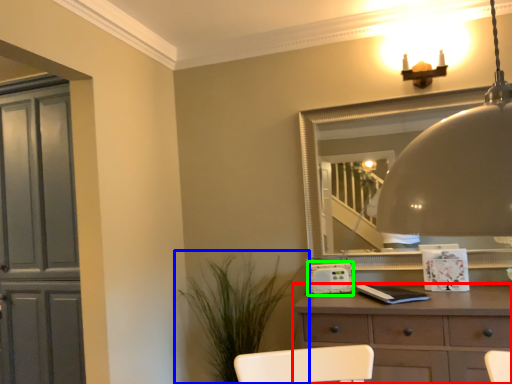
Question: Which is farther away from chest of drawers (highlighted by a red box)? houseplant (highlighted by a blue box) or appliance (highlighted by a green box)?

Choices:
 (A) houseplant
 (B) appliance

Answer: (A)